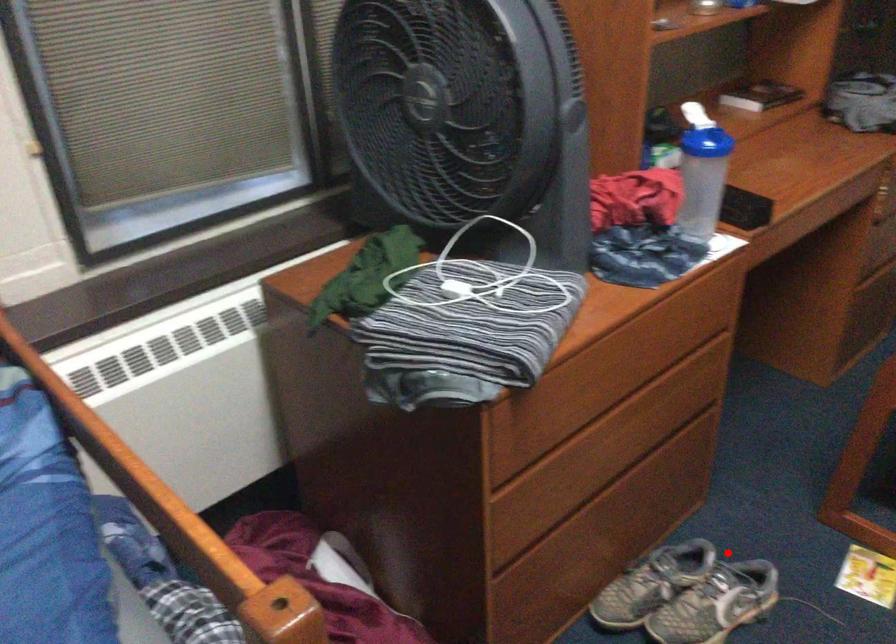
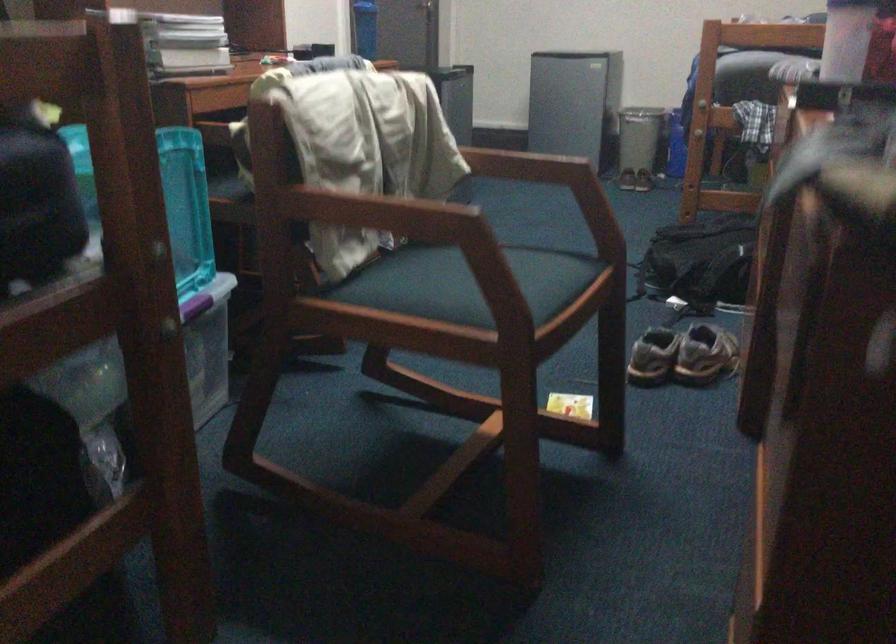
Question: I am providing you with two images of the same scene from different viewpoints. Given a red point in image1, look at the same physical point in image2. Is it:

Choices:
 (A) Closer to the viewpoint
 (B) Farther from the viewpoint

Answer: (B)